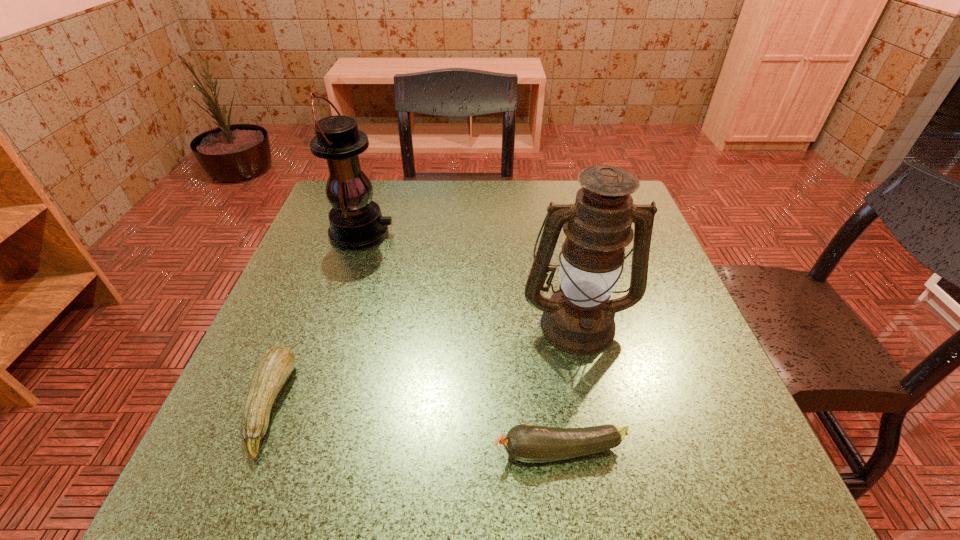
Identify the location of lantern. (356, 222).

I want to click on the third nearest object, so click(x=579, y=318).

At what (x,y) coordinates should I click in order to perform the action: click on the left zucchini. Please return your answer as a coordinate pair (x, y). The image size is (960, 540). Looking at the image, I should click on (272, 371).

Identify the location of the right zucchini. (528, 443).

Where can I find a free point located 0.360m above the farthest object, indicating its light source? Please provide its 2D coordinates. Your answer should be formatted as a tuple, i.e. [(x, y)], where the tuple contains the x and y coordinates of a point satisfying the conditions above.

[(541, 233)]

Image resolution: width=960 pixels, height=540 pixels. I want to click on free space located 0.090m on the left of the oil lamp, so click(x=475, y=323).

The image size is (960, 540). Identify the location of vacant region located at the stem end of the left zucchini. (359, 406).

Find the location of a particular element. The width and height of the screenshot is (960, 540). free spot located 0.100m at the blossom end of the right zucchini is located at coordinates (427, 451).

At what (x,y) coordinates should I click in order to perform the action: click on free space located 0.220m at the blossom end of the right zucchini. Please return your answer as a coordinate pair (x, y). Looking at the image, I should click on (348, 451).

At what (x,y) coordinates should I click in order to perform the action: click on free spot located 0.300m at the blossom end of the right zucchini. Please return your answer as a coordinate pair (x, y). The height and width of the screenshot is (540, 960). Looking at the image, I should click on (295, 451).